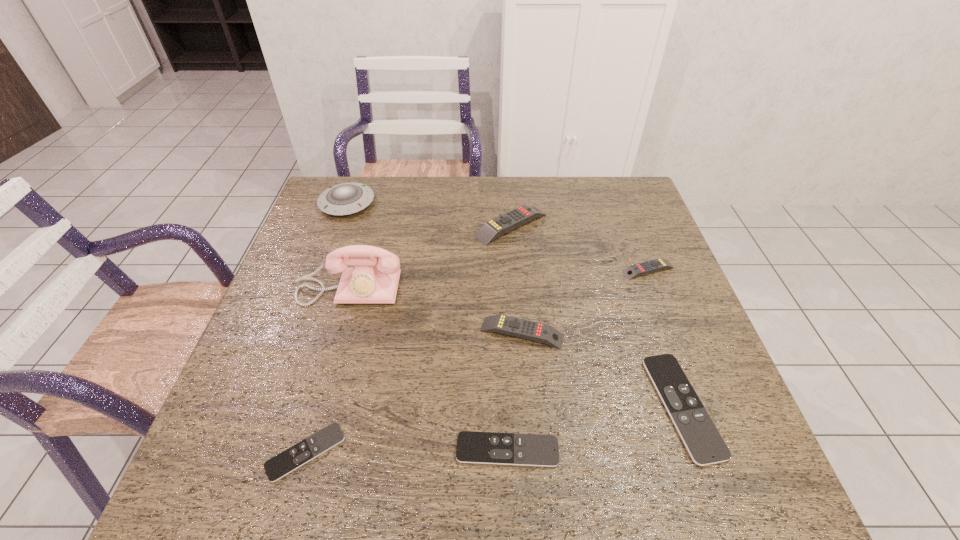
At what (x,y) coordinates should I click in order to perform the action: click on the rightmost black remote control. Please return your answer as a coordinate pair (x, y). Looking at the image, I should click on (700, 436).

Locate an element on the screen. the second black remote control from left to right is located at coordinates (472, 447).

Locate an element on the screen. the fifth tallest remote control is located at coordinates (472, 447).

You are a GUI agent. You are given a task and a screenshot of the screen. Output one action in this format:
    pyautogui.click(x=<x>, y=<y>)
    Task: Click on the leftmost remote control
    The height and width of the screenshot is (540, 960).
    Given the screenshot: What is the action you would take?
    pyautogui.click(x=306, y=450)

Where is `the smallest black remote control`? The height and width of the screenshot is (540, 960). the smallest black remote control is located at coordinates coord(306,450).

This screenshot has height=540, width=960. What are the coordinates of `free space located 0.240m on the dial of the tallest object` in the screenshot? It's located at (320, 393).

The height and width of the screenshot is (540, 960). Identify the location of free region located 0.330m on the front of the seventh shortest object. (312, 302).

Where is `free spot located on the left of the biggest yellow remote control`? free spot located on the left of the biggest yellow remote control is located at coordinates (457, 225).

Where is `free spot located on the left of the nearest yellow remote control`? free spot located on the left of the nearest yellow remote control is located at coordinates (344, 333).

Identify the location of blank space located on the back of the second nearest yellow remote control. (628, 218).